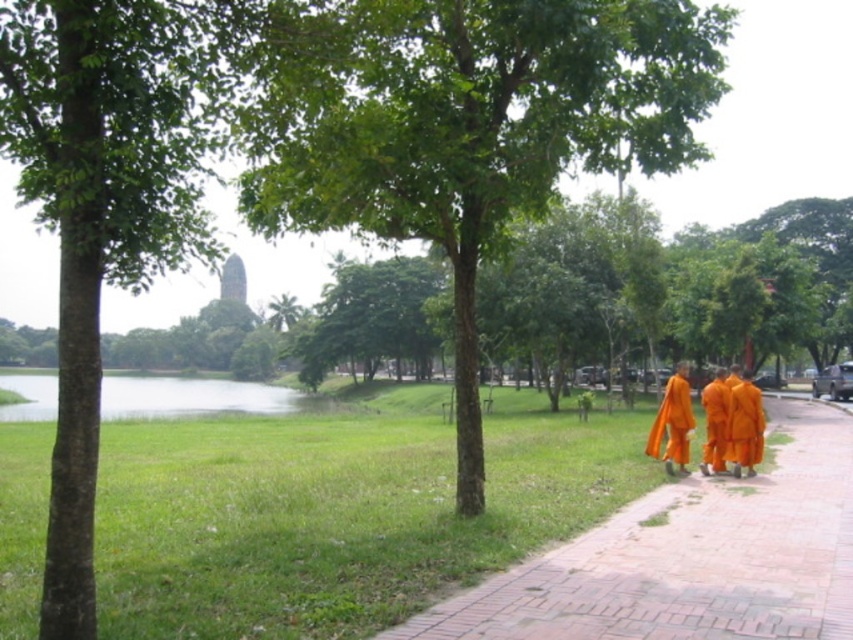
You are standing at the starting point of the pathway in the park and want to reach the green leafy tree at center. According to the coordinates provided, in which direction should you walk to reach it?

The green leafy tree at center is located at coordinates point [473,129], so you should walk towards the center of the park to reach it.

You are a hiker who wants to take a photo of the green leafy tree at center without the brick pavement at lower right appearing in the background. Which direction should you move to frame the tree without the pavement?

The green leafy tree at center is taller than the brick pavement at lower right. To avoid the pavement in the background, move to a position where the tree is framed such that the pavement is out of the shot. Since the tree is taller, moving closer to the tree or adjusting the camera angle upward might help obscure the pavement below.

You are standing at the point with coordinates point (677, 637) and want to walk towards the group of monks in orange robes. Will you have to walk towards or away from the point with coordinates point (682, 410) to reach them?

Since point (677, 637) is closer to the viewer than point (682, 410), walking towards the group of monks in orange robes would require moving away from point (682, 410).